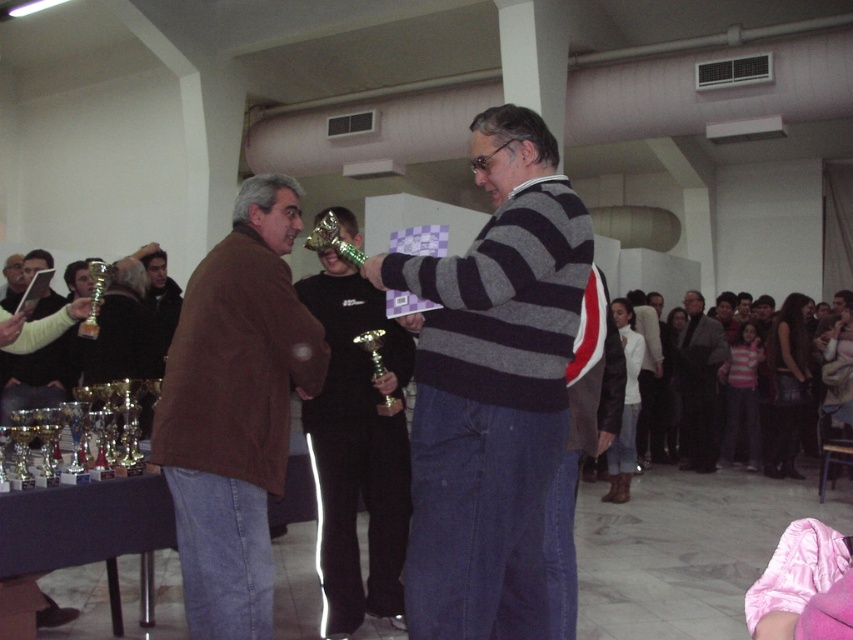
Can you confirm if brown leather jacket at left is bigger than dark gray wool sweater at center?

Incorrect, brown leather jacket at left is not larger than dark gray wool sweater at center.

Does point (260, 179) come closer to viewer compared to point (677, 380)?

Yes, it is.

Between point (165, 404) and point (675, 355), which one is positioned in front?

Point (165, 404) is more forward.

Where is `brown leather jacket at left`? brown leather jacket at left is located at coordinates (235, 410).

What do you see at coordinates (491, 388) in the screenshot? The height and width of the screenshot is (640, 853). I see `striped sweater at center` at bounding box center [491, 388].

Locate an element on the screen. Image resolution: width=853 pixels, height=640 pixels. striped sweater at center is located at coordinates (491, 388).

Is striped sweater at center smaller than brown leather jacket at left?

No, striped sweater at center is not smaller than brown leather jacket at left.

Which is below, striped sweater at center or brown leather jacket at left?

brown leather jacket at left is below.

Image resolution: width=853 pixels, height=640 pixels. I want to click on striped sweater at center, so click(491, 388).